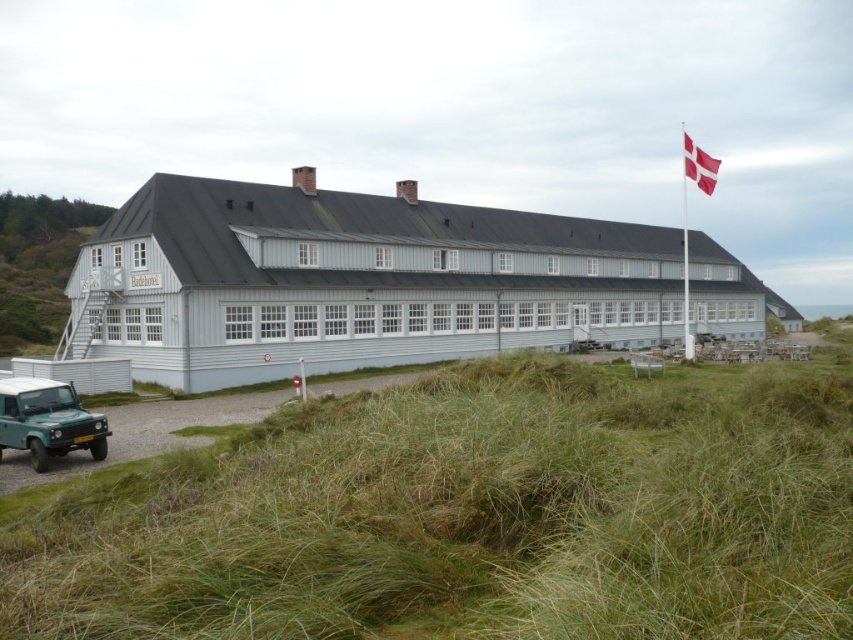
Question: Is green grassy at lower left smaller than white fabric flag at upper right?

Choices:
 (A) yes
 (B) no

Answer: (A)

Question: Considering the real-world distances, which object is farthest from the green grassy at lower left?

Choices:
 (A) green matte jeep at lower left
 (B) white fabric flag at upper right
 (C) white wooden flag pole at upper right

Answer: (B)

Question: In this image, where is green grassy at lower left located relative to green matte jeep at lower left?

Choices:
 (A) below
 (B) above

Answer: (B)

Question: Among these points, which one is nearest to the camera?

Choices:
 (A) (56, 387)
 (B) (190, 589)
 (C) (683, 147)
 (D) (715, 176)

Answer: (B)

Question: Which of the following is the farthest from the observer?

Choices:
 (A) (686, 134)
 (B) (693, 152)
 (C) (514, 630)

Answer: (A)

Question: Can you confirm if green grassy at lower left is wider than white wooden flag pole at upper right?

Choices:
 (A) no
 (B) yes

Answer: (A)